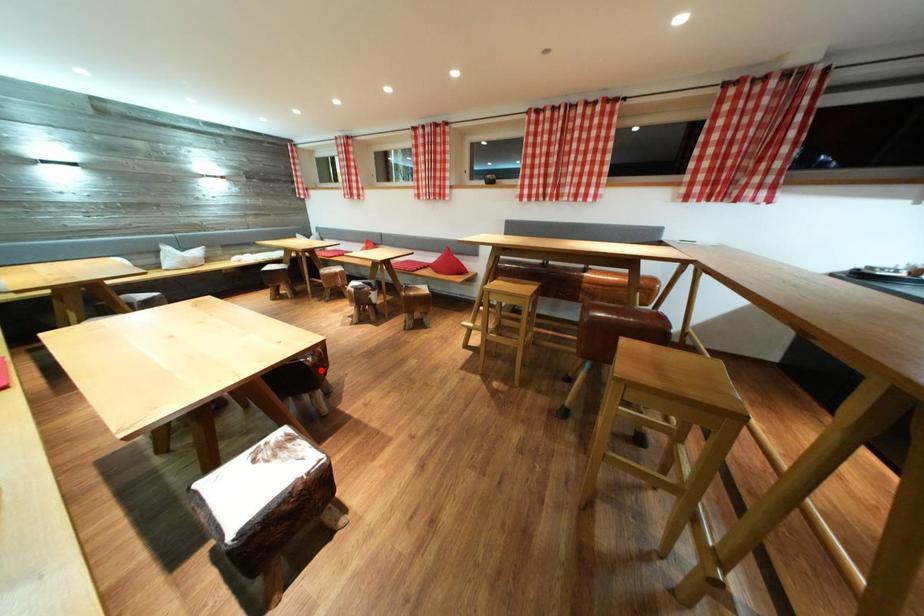
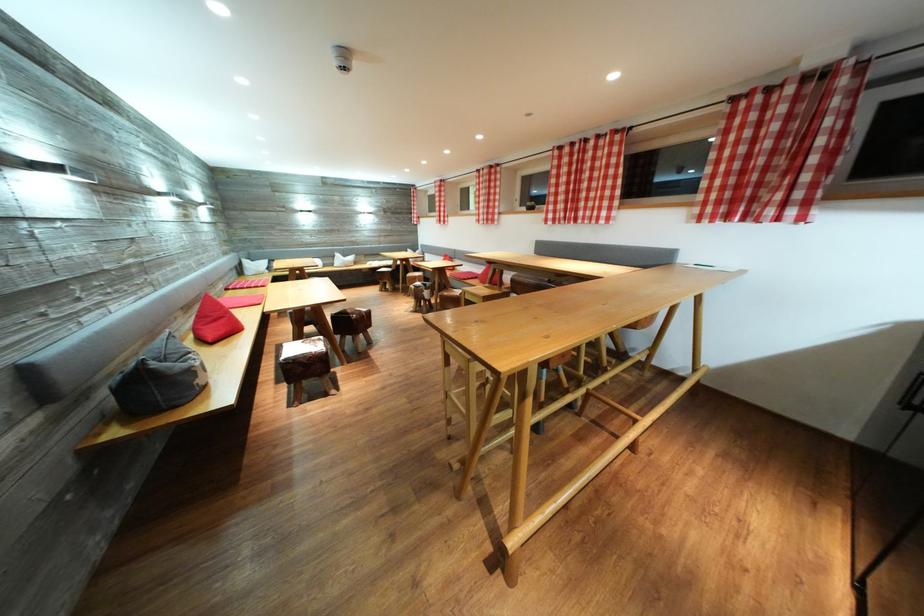
Where in the second image is the point corresponding to the highlighted location from the first image?

(362, 325)